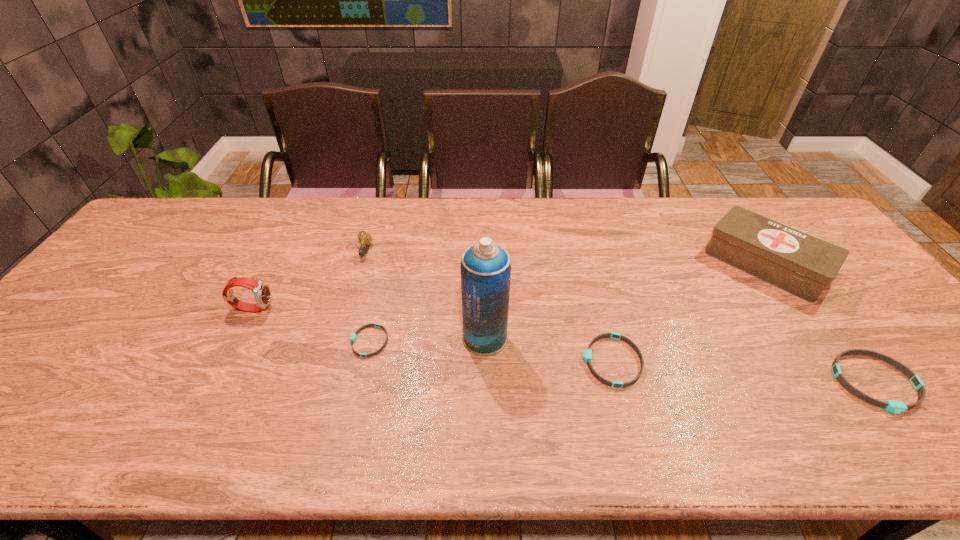
This screenshot has height=540, width=960. What are the coordinates of `the fifth object from right to left` in the screenshot? It's located at (353, 337).

Identify the location of the shortest object. The image size is (960, 540). (353, 337).

You are a GUI agent. You are given a task and a screenshot of the screen. Output one action in this format:
    pyautogui.click(x=<x>, y=<y>)
    Task: Click on the sixth tallest object
    The image size is (960, 540).
    Given the screenshot: What is the action you would take?
    pyautogui.click(x=587, y=354)

You are a GUI agent. You are given a task and a screenshot of the screen. Output one action in this format:
    pyautogui.click(x=<x>, y=<y>)
    Task: Click on the fifth object from left to right
    This screenshot has height=540, width=960.
    Given the screenshot: What is the action you would take?
    pyautogui.click(x=587, y=354)

This screenshot has height=540, width=960. I want to click on the rightmost wristband, so (897, 407).

Where is `the fourth shortest object`? This screenshot has width=960, height=540. the fourth shortest object is located at coordinates (365, 238).

Image resolution: width=960 pixels, height=540 pixels. In order to click on the second object from left to right in this screenshot , I will do `click(365, 238)`.

Where is `the first-aid kit`? the first-aid kit is located at coordinates (799, 263).

The height and width of the screenshot is (540, 960). Find the location of `watch`. watch is located at coordinates (262, 294).

The width and height of the screenshot is (960, 540). In order to click on aerosol can in this screenshot , I will do `click(485, 267)`.